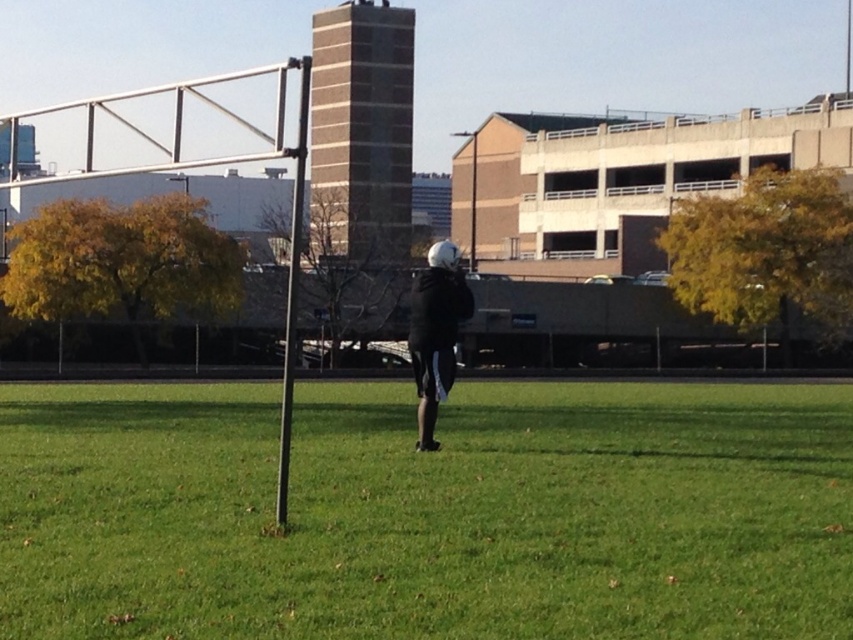
Which of these two, green grass at center or black matte jacket at center, stands shorter?

With less height is green grass at center.

Can you confirm if green grass at center is positioned above black matte jacket at center?

Incorrect, green grass at center is not positioned above black matte jacket at center.

The image size is (853, 640). Identify the location of green grass at center. (427, 513).

Locate an element on the screen. This screenshot has width=853, height=640. green grass at center is located at coordinates (427, 513).